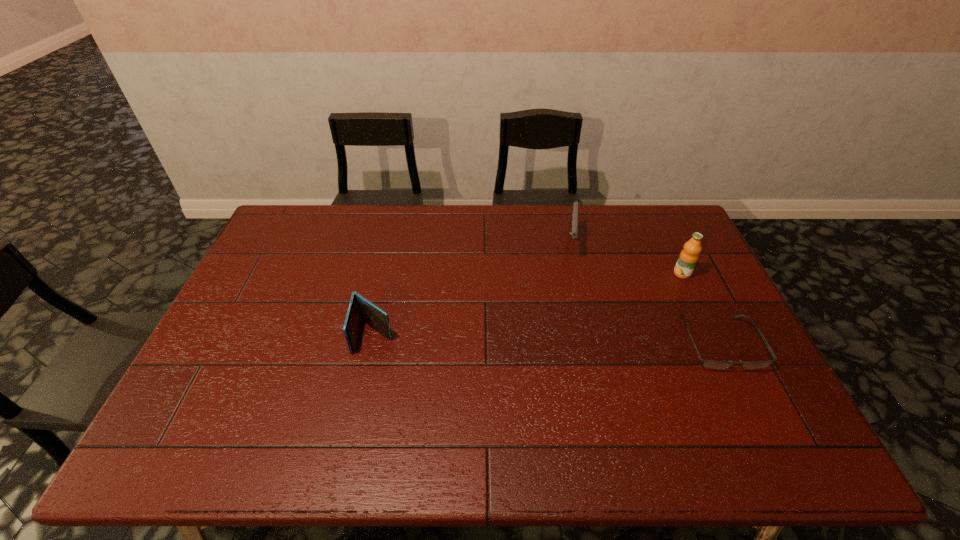
Where is `free space on the desktop that is between the wallet and the spectacles and is positioned on the label of the tallest object`? Image resolution: width=960 pixels, height=540 pixels. free space on the desktop that is between the wallet and the spectacles and is positioned on the label of the tallest object is located at coordinates (539, 339).

Identify the location of free space on the desktop that is between the leftmost object and the spectacles and is positioned at the barrel of the pistol. This screenshot has height=540, width=960. (565, 340).